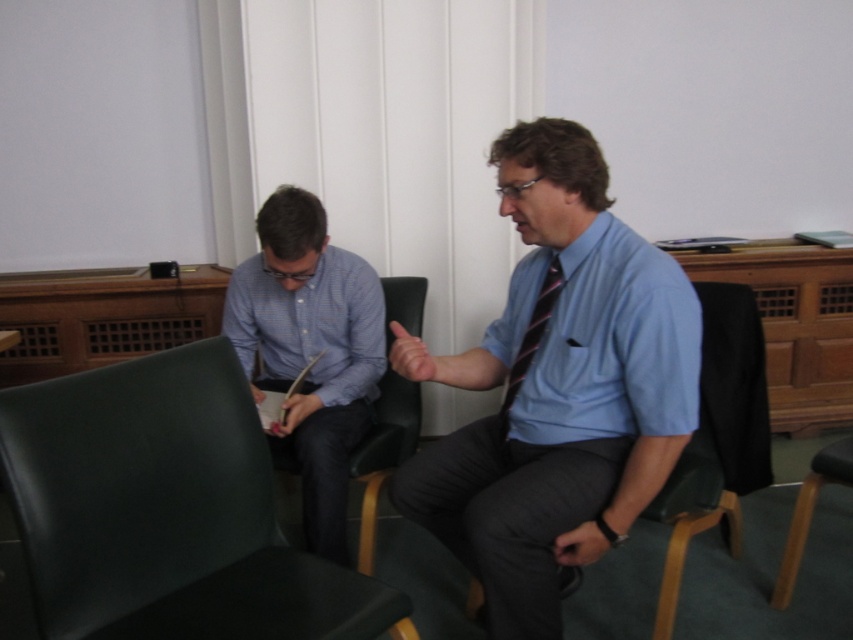
Between matte black swivel chair at left and striped fabric tie at center, which one appears on the right side from the viewer's perspective?

striped fabric tie at center

Which is in front, point (90, 634) or point (532, 349)?

Positioned in front is point (90, 634).

Does point (248, 436) come behind point (550, 269)?

No.

Find the location of a particular element. This screenshot has height=640, width=853. matte black swivel chair at left is located at coordinates (166, 512).

Does blue shirt at center have a greater width compared to black leather chair at center?

Yes, blue shirt at center is wider than black leather chair at center.

Which of these two, blue shirt at center or black leather chair at center, stands shorter?

Standing shorter between the two is black leather chair at center.

Describe the element at coordinates (556, 388) in the screenshot. The width and height of the screenshot is (853, 640). I see `blue shirt at center` at that location.

Find the location of a particular element. blue shirt at center is located at coordinates (556, 388).

Does blue shirt at center appear on the left side of matte black swivel chair at left?

Incorrect, blue shirt at center is not on the left side of matte black swivel chair at left.

Is blue shirt at center behind matte black swivel chair at left?

Yes.

You are a GUI agent. You are given a task and a screenshot of the screen. Output one action in this format:
    pyautogui.click(x=<x>, y=<y>)
    Task: Click on the blue shirt at center
    This screenshot has height=640, width=853.
    Given the screenshot: What is the action you would take?
    pyautogui.click(x=556, y=388)